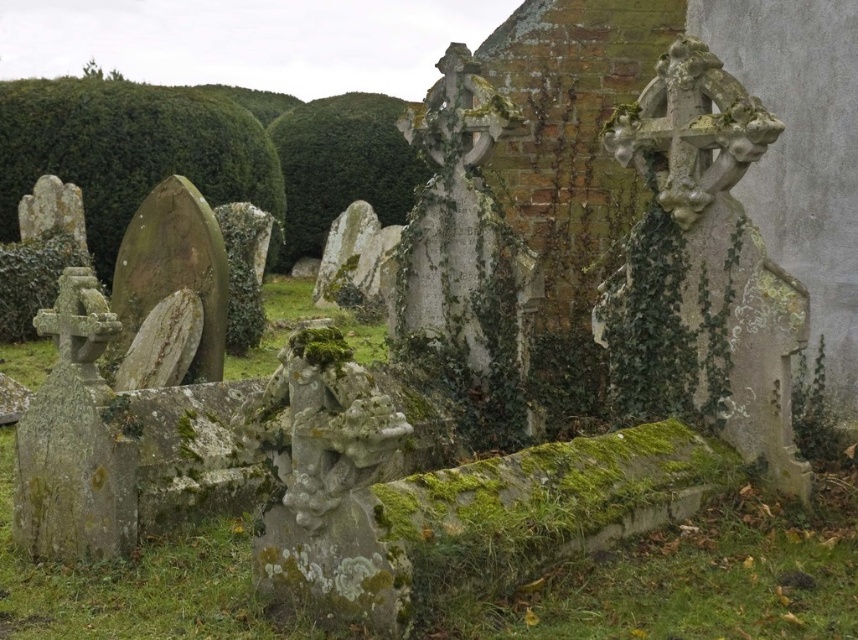
What do you see at coordinates (128, 150) in the screenshot? I see `green mossy hedge at upper left` at bounding box center [128, 150].

The width and height of the screenshot is (858, 640). Find the location of `green mossy hedge at upper left`. green mossy hedge at upper left is located at coordinates (128, 150).

What are the coordinates of `green mossy hedge at upper left` in the screenshot? It's located at (128, 150).